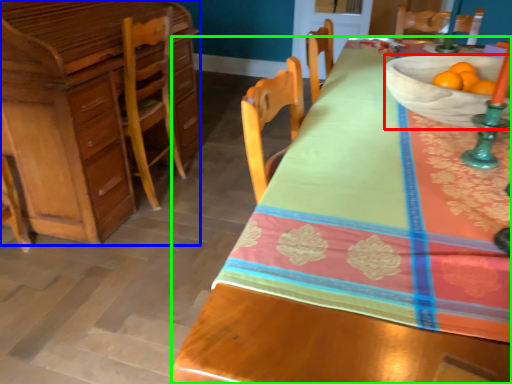
Question: Based on their relative distances, which object is farther from bowl (highlighted by a red box)? Choose from cabinetry (highlighted by a blue box) and desk (highlighted by a green box).

Choices:
 (A) cabinetry
 (B) desk

Answer: (A)